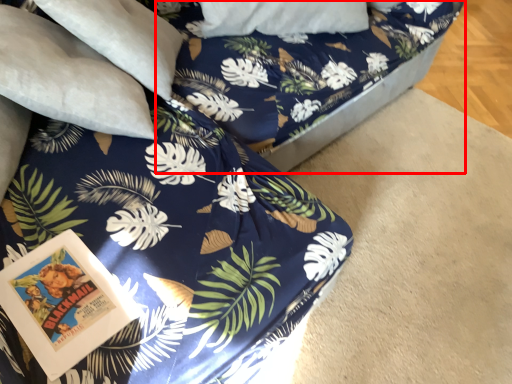
Question: From the image's perspective, where is bed frame (annotated by the red box) located relative to pillow?

Choices:
 (A) above
 (B) below

Answer: (A)